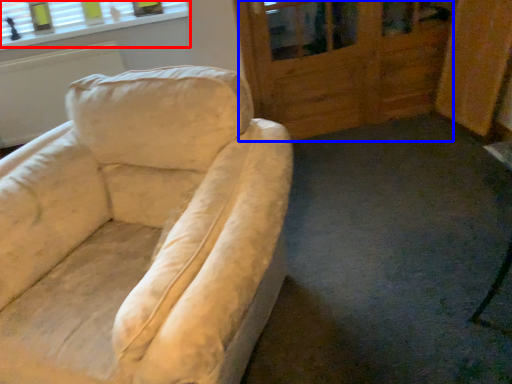
Question: Among these objects, which one is nearest to the camera, window (highlighted by a red box) or screen door (highlighted by a blue box)?

Choices:
 (A) window
 (B) screen door

Answer: (B)